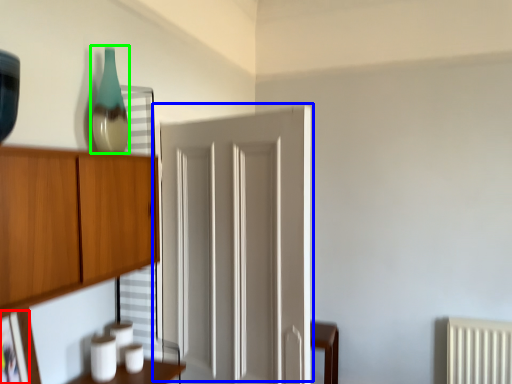
Question: Which object is positioned farthest from picture frame (highlighted by a red box)? Select from door (highlighted by a blue box) and glass vase (highlighted by a green box).

Choices:
 (A) door
 (B) glass vase

Answer: (A)